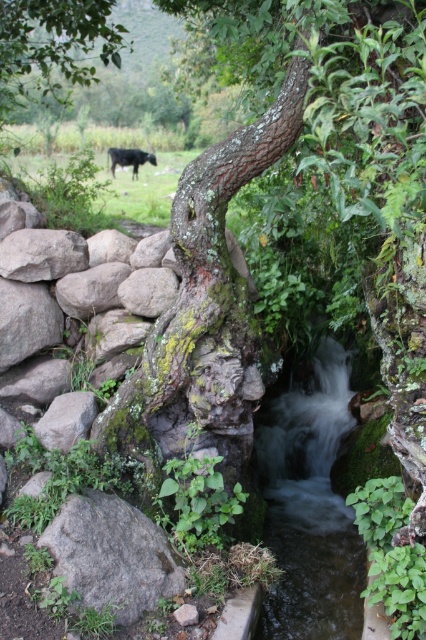
You are standing at the edge of the stream and want to cross to the other side. The green mossy rock at lower left is slippery. Which object should you step on first to safely cross the clear water stream at center?

You should step on the green mossy rock at lower left first because it is positioned behind the clear water stream at center, making it a stable starting point for crossing.

You are a hiker carrying a 1.5 meter long wooden plank. You want to cross the clear water stream at center. There is a green mossy rock at lower left nearby. Can you place the plank on the rock to cross the stream?

The clear water stream at center might be wider than green mossy rock at lower left, so the plank might not span the stream if it is wider than the rock. Check the actual width before placing the plank.